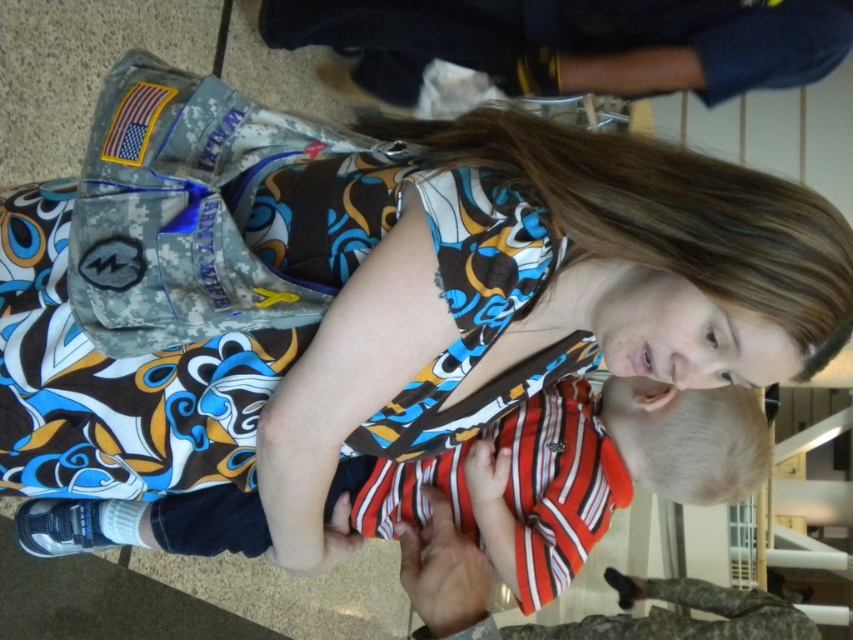
Is printed fabric dress at center to the right of striped cotton shirt at center from the viewer's perspective?

No, printed fabric dress at center is not to the right of striped cotton shirt at center.

From the picture: Is the position of printed fabric dress at center less distant than that of striped cotton shirt at center?

Yes, printed fabric dress at center is in front of striped cotton shirt at center.

The image size is (853, 640). I want to click on printed fabric dress at center, so click(115, 381).

The height and width of the screenshot is (640, 853). I want to click on printed fabric dress at center, so click(115, 381).